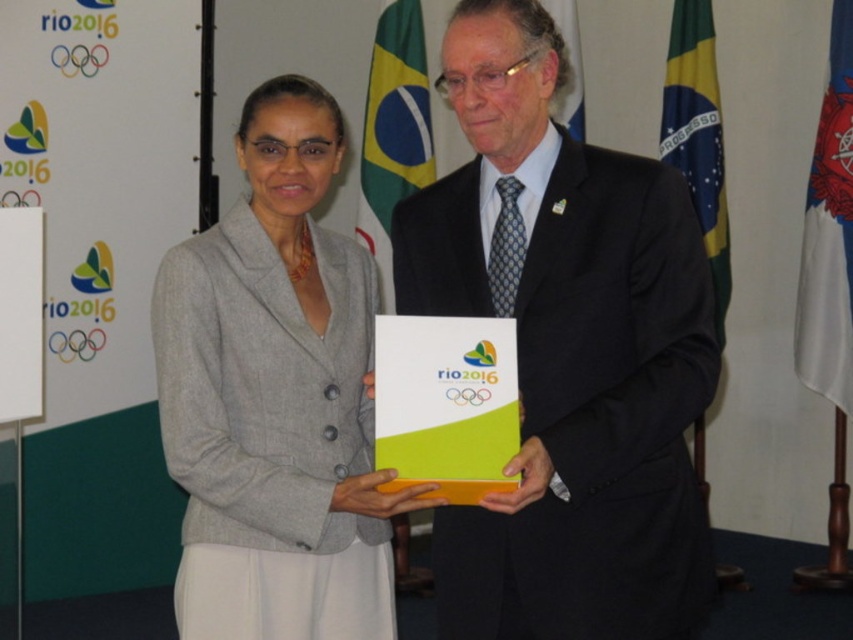
Question: Which of these objects is positioned farthest from the black suit at center?

Choices:
 (A) yellowmaterial/textureflag at right
 (B) gray woolen blazer at center
 (C) blue fabric flag at right

Answer: (C)

Question: Can you confirm if black suit at center is wider than green/yellow fabric flag at upper right?

Choices:
 (A) yes
 (B) no

Answer: (A)

Question: Does black suit at center appear on the left side of green/yellow fabric flag at upper right?

Choices:
 (A) no
 (B) yes

Answer: (B)

Question: Based on their relative distances, which object is farther from the black suit at center?

Choices:
 (A) blue fabric flag at right
 (B) gray woolen blazer at center
 (C) green/yellow fabric flag at upper right

Answer: (A)

Question: Among these points, which one is farthest from the camera?

Choices:
 (A) (209, 589)
 (B) (457, 604)

Answer: (A)

Question: Is black suit at center to the right of blue fabric flag at right from the viewer's perspective?

Choices:
 (A) no
 (B) yes

Answer: (A)